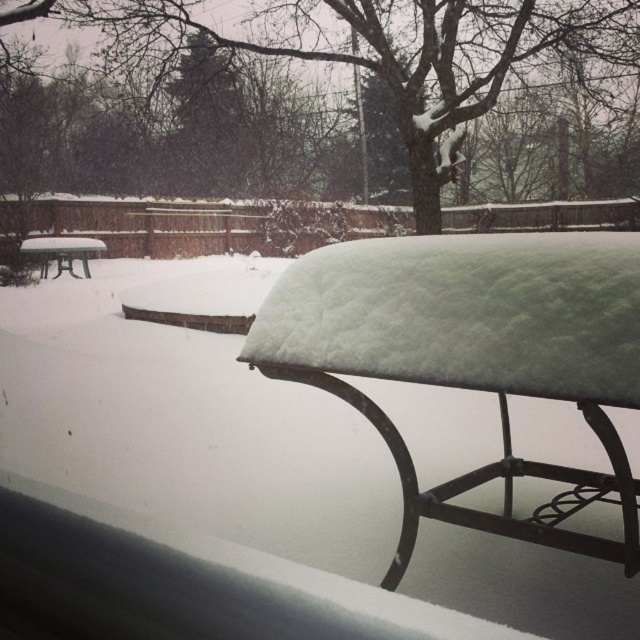
Does white snow-covered bench at center appear on the left side of green plastic picnic table at left?

Incorrect, white snow-covered bench at center is not on the left side of green plastic picnic table at left.

Is white snow-covered bench at center thinner than green plastic picnic table at left?

Indeed, white snow-covered bench at center has a lesser width compared to green plastic picnic table at left.

Describe the element at coordinates (474, 355) in the screenshot. This screenshot has height=640, width=640. I see `white snow-covered bench at center` at that location.

Find the location of a particular element. This screenshot has width=640, height=640. white snow-covered bench at center is located at coordinates (474, 355).